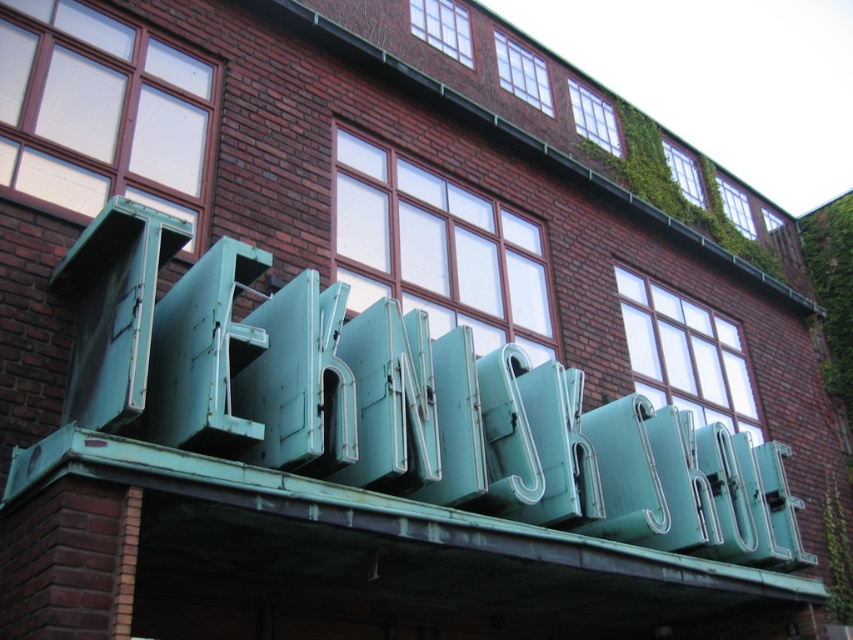
Is green patina sign at center to the left of green matte neon sign at center from the viewer's perspective?

Indeed, green patina sign at center is positioned on the left side of green matte neon sign at center.

Can you confirm if green patina sign at center is positioned to the right of green matte neon sign at center?

Incorrect, green patina sign at center is not on the right side of green matte neon sign at center.

The height and width of the screenshot is (640, 853). Find the location of `green patina sign at center`. green patina sign at center is located at coordinates 396,403.

Where is `green patina sign at center`? The height and width of the screenshot is (640, 853). green patina sign at center is located at coordinates click(396, 403).